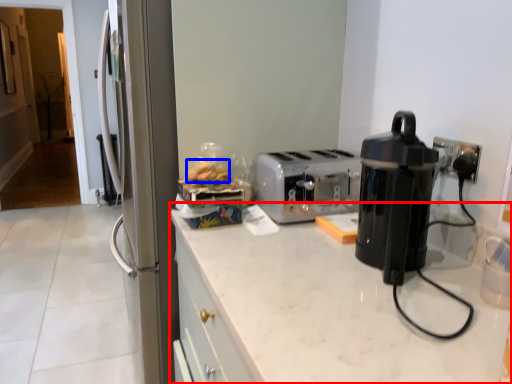
Question: Which object appears farthest to the camera in this image, countertop (highlighted by a red box) or food (highlighted by a blue box)?

Choices:
 (A) countertop
 (B) food

Answer: (B)